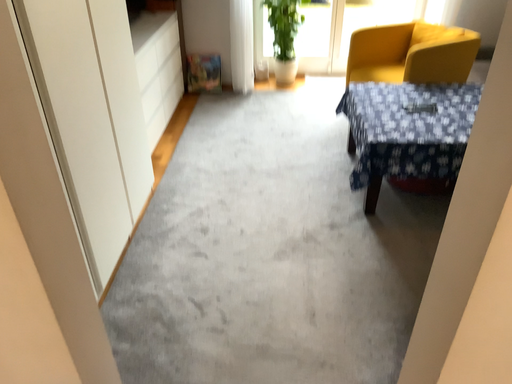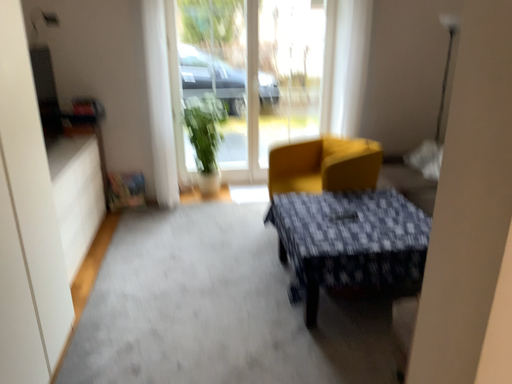
Question: Which way did the camera rotate in the video?

Choices:
 (A) rotated upward
 (B) rotated downward

Answer: (A)